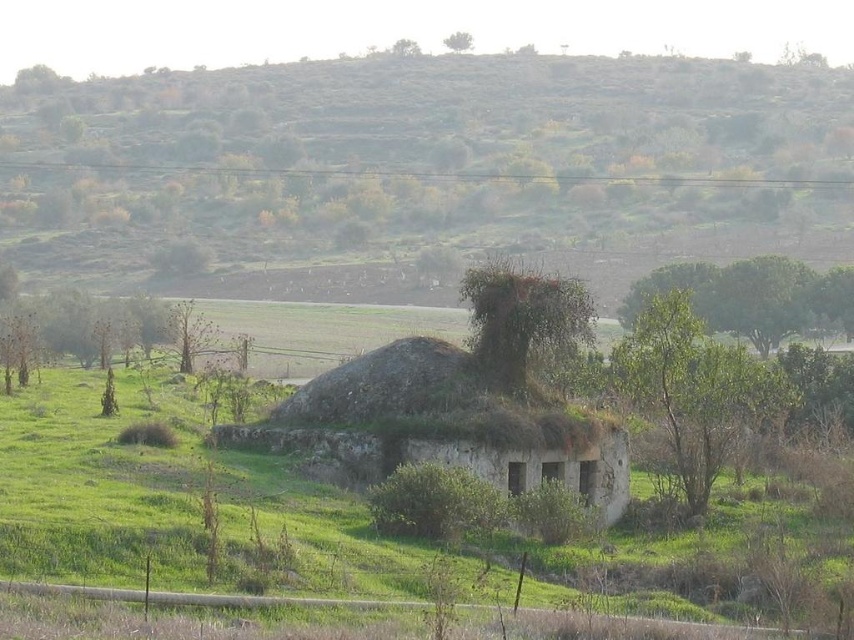
Question: Which object is closer to the camera taking this photo?

Choices:
 (A) green grassy hillside at upper center
 (B) green grassy at center

Answer: (B)

Question: Is the position of green grassy hillside at upper center more distant than that of green grassy at center?

Choices:
 (A) yes
 (B) no

Answer: (A)

Question: Is green grassy hillside at upper center above green grassy at center?

Choices:
 (A) yes
 (B) no

Answer: (A)

Question: Is green grassy hillside at upper center above green grassy at center?

Choices:
 (A) yes
 (B) no

Answer: (A)

Question: Which object appears closest to the camera in this image?

Choices:
 (A) green grassy hillside at upper center
 (B) green grassy at center

Answer: (B)